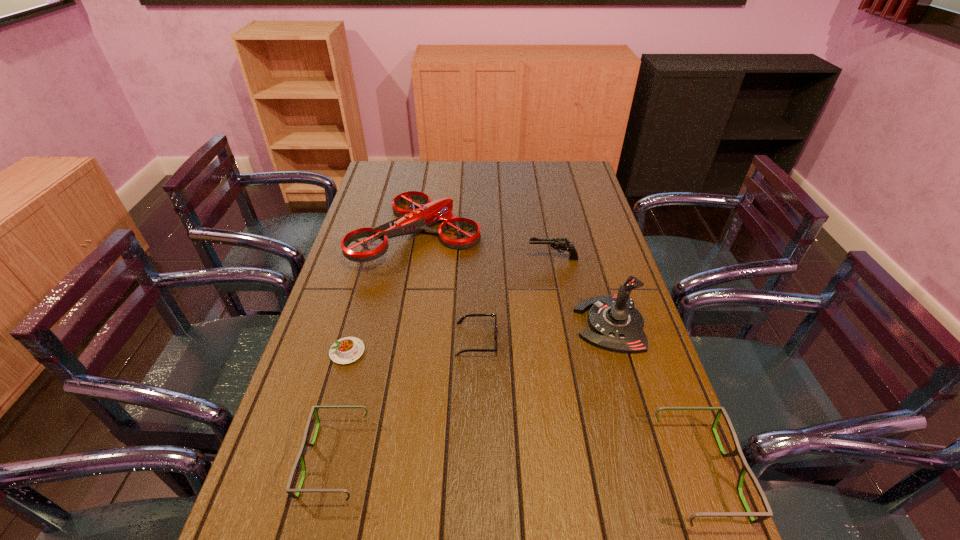
Please point a location where one more spectacles can be added evenly. Please provide its 2D coordinates. Your answer should be formatted as a tuple, i.e. [(x, y)], where the tuple contains the x and y coordinates of a point satisfying the conditions above.

[(515, 466)]